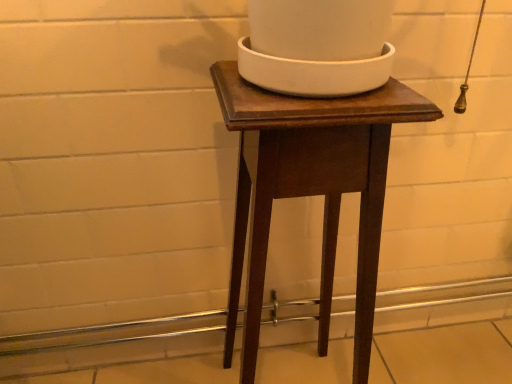
Locate an element on the screen. This screenshot has height=384, width=512. empty space that is ontop of matte dark wood stool at center is located at coordinates (307, 92).